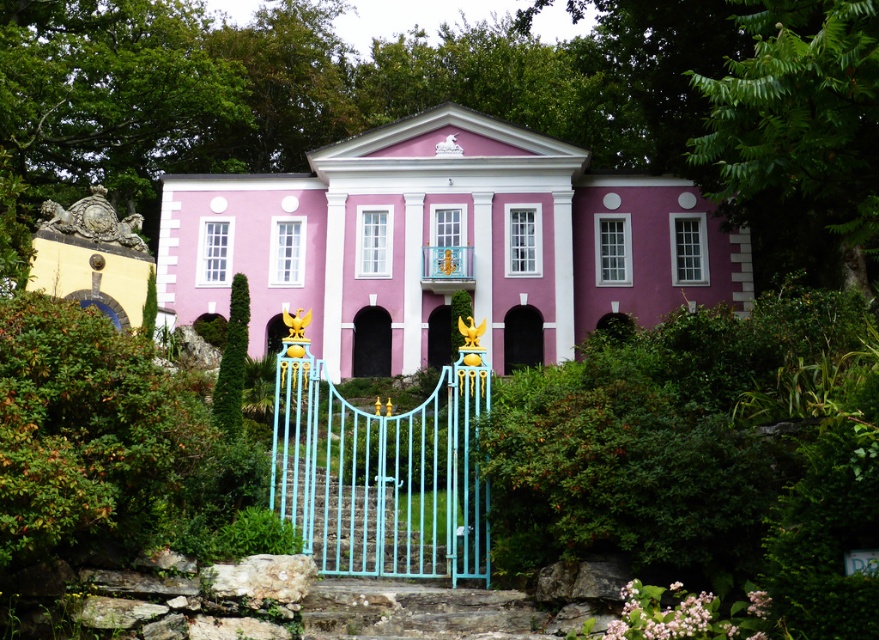
Does black stone archway at center have a lesser height compared to metallic gold door at center?

No.

Is point (522, 316) more distant than point (434, 332)?

Yes, point (522, 316) is behind point (434, 332).

This screenshot has width=879, height=640. Describe the element at coordinates (522, 337) in the screenshot. I see `black stone archway at center` at that location.

Identify the location of black stone archway at center. The width and height of the screenshot is (879, 640). (522, 337).

Is light blue painted metal gate at center further to the viewer compared to black stone archway at center?

No, light blue painted metal gate at center is in front of black stone archway at center.

Which is behind, point (462, 410) or point (529, 333)?

The point (529, 333) is behind.

Where is `light blue painted metal gate at center`? light blue painted metal gate at center is located at coordinates (382, 472).

Which is below, pink matte door at center or metallic gold door at center?

pink matte door at center

Does pink matte door at center have a greater width compared to metallic gold door at center?

Indeed, pink matte door at center has a greater width compared to metallic gold door at center.

Does point (375, 342) lie in front of point (434, 362)?

No, it is behind (434, 362).

Identify the location of pink matte door at center. The height and width of the screenshot is (640, 879). (371, 342).